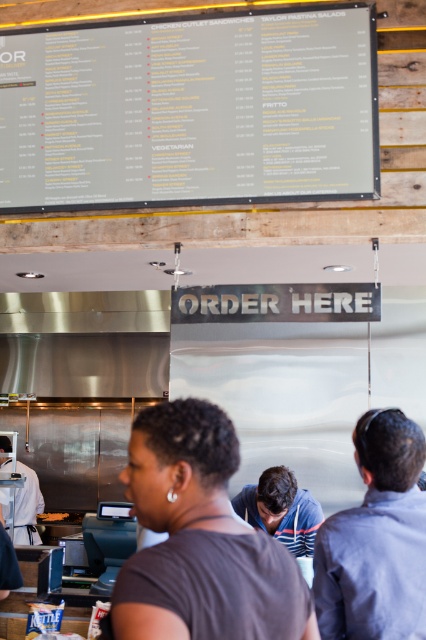
Is dark brown hair at center wider than blue shirt at center?

Indeed, dark brown hair at center has a greater width compared to blue shirt at center.

Between dark brown hair at center and blue shirt at center, which one is positioned higher?

dark brown hair at center is higher up.

Between point (184, 512) and point (354, 579), which one is positioned behind?

Positioned behind is point (354, 579).

What are the coordinates of `dark brown hair at center` in the screenshot? It's located at (199, 540).

Is gray matte menu board at upper center above golden crispy fries at center?

Yes.

Does point (281, 51) come farther from viewer compared to point (60, 518)?

No, (281, 51) is in front of (60, 518).

Where is `gray matte menu board at upper center`? The width and height of the screenshot is (426, 640). gray matte menu board at upper center is located at coordinates (190, 109).

Between blue shirt at center and golden crispy fries at center, which one appears on the left side from the viewer's perspective?

golden crispy fries at center is more to the left.

The height and width of the screenshot is (640, 426). What do you see at coordinates (376, 540) in the screenshot? I see `blue shirt at center` at bounding box center [376, 540].

Locate an element on the screen. The height and width of the screenshot is (640, 426). blue shirt at center is located at coordinates [376, 540].